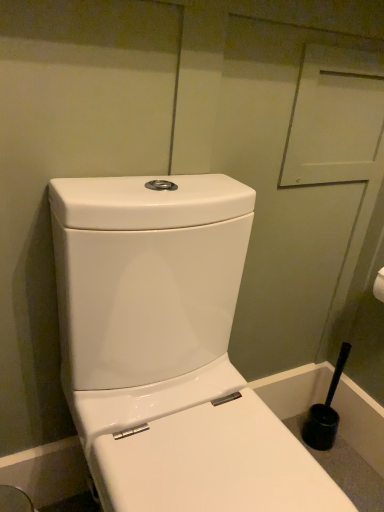
Describe the element at coordinates (168, 349) in the screenshot. I see `white glossy toilet at center` at that location.

This screenshot has height=512, width=384. What are the coordinates of `white glossy toilet at center` in the screenshot? It's located at (168, 349).

This screenshot has height=512, width=384. What do you see at coordinates (325, 411) in the screenshot?
I see `black plastic toilet brush at lower right` at bounding box center [325, 411].

In order to click on black plastic toilet brush at lower right in this screenshot , I will do `click(325, 411)`.

Locate an element on the screen. white glossy toilet at center is located at coordinates (168, 349).

In the image, is white glossy toilet at center on the left side or the right side of black plastic toilet brush at lower right?

From the image, it's evident that white glossy toilet at center is to the left of black plastic toilet brush at lower right.

Is the depth of white glossy toilet at center less than that of black plastic toilet brush at lower right?

Yes, it is in front of black plastic toilet brush at lower right.

Does point (201, 233) lie in front of point (322, 431)?

Yes, point (201, 233) is in front of point (322, 431).

From the image's perspective, between white glossy toilet at center and black plastic toilet brush at lower right, who is located below?

black plastic toilet brush at lower right, from the image's perspective.

From a real-world perspective, is white glossy toilet at center positioned above or below black plastic toilet brush at lower right?

Clearly, from a real-world perspective, white glossy toilet at center is above black plastic toilet brush at lower right.

Is white glossy toilet at center wider than black plastic toilet brush at lower right?

Yes.

Considering the sizes of objects white glossy toilet at center and black plastic toilet brush at lower right in the image provided, who is shorter, white glossy toilet at center or black plastic toilet brush at lower right?

With less height is black plastic toilet brush at lower right.

Is white glossy toilet at center smaller than black plastic toilet brush at lower right?

No, white glossy toilet at center is not smaller than black plastic toilet brush at lower right.

Is white glossy toilet at center completely or partially outside of black plastic toilet brush at lower right?

Yes.

Is white glossy toilet at center next to black plastic toilet brush at lower right and touching it?

white glossy toilet at center and black plastic toilet brush at lower right are not in contact.

Is white glossy toilet at center oriented away from black plastic toilet brush at lower right?

No, white glossy toilet at center's orientation is not away from black plastic toilet brush at lower right.

The width and height of the screenshot is (384, 512). What are the coordinates of `toilet lying on the left of black plastic toilet brush at lower right` in the screenshot? It's located at (168, 349).

In the image, is black plastic toilet brush at lower right on the left side or the right side of white glossy toilet at center?

Clearly, black plastic toilet brush at lower right is on the right of white glossy toilet at center in the image.

Does black plastic toilet brush at lower right lie in front of white glossy toilet at center?

No, it is behind white glossy toilet at center.

Is point (308, 416) closer to viewer compared to point (160, 234)?

No, it is behind (160, 234).

From the image's perspective, which one is positioned higher, black plastic toilet brush at lower right or white glossy toilet at center?

white glossy toilet at center appears higher in the image.

From a real-world perspective, is black plastic toilet brush at lower right physically below white glossy toilet at center?

Yes.

Is black plastic toilet brush at lower right wider than white glossy toilet at center?

No.

Consider the image. Who is shorter, black plastic toilet brush at lower right or white glossy toilet at center?

black plastic toilet brush at lower right.

Does black plastic toilet brush at lower right have a larger size compared to white glossy toilet at center?

Actually, black plastic toilet brush at lower right might be smaller than white glossy toilet at center.

Is black plastic toilet brush at lower right inside the boundaries of white glossy toilet at center, or outside?

black plastic toilet brush at lower right is not inside white glossy toilet at center, it's outside.

Would you say black plastic toilet brush at lower right is a long distance from white glossy toilet at center?

black plastic toilet brush at lower right is near white glossy toilet at center, not far away.

Is black plastic toilet brush at lower right facing towards white glossy toilet at center?

No, black plastic toilet brush at lower right is not oriented towards white glossy toilet at center.

What's the angular difference between black plastic toilet brush at lower right and white glossy toilet at center's facing directions?

There is a 1.37-degree angle between the facing directions of black plastic toilet brush at lower right and white glossy toilet at center.

At what (x,y) coordinates should I click in order to perform the action: click on toilet above the black plastic toilet brush at lower right (from the image's perspective). Please return your answer as a coordinate pair (x, y). Image resolution: width=384 pixels, height=512 pixels. Looking at the image, I should click on (168, 349).

In the image, there is a black plastic toilet brush at lower right. Where is `toilet above it (from the image's perspective)`? The width and height of the screenshot is (384, 512). toilet above it (from the image's perspective) is located at coordinates (168, 349).

The height and width of the screenshot is (512, 384). Identify the location of toilet in front of the black plastic toilet brush at lower right. (168, 349).